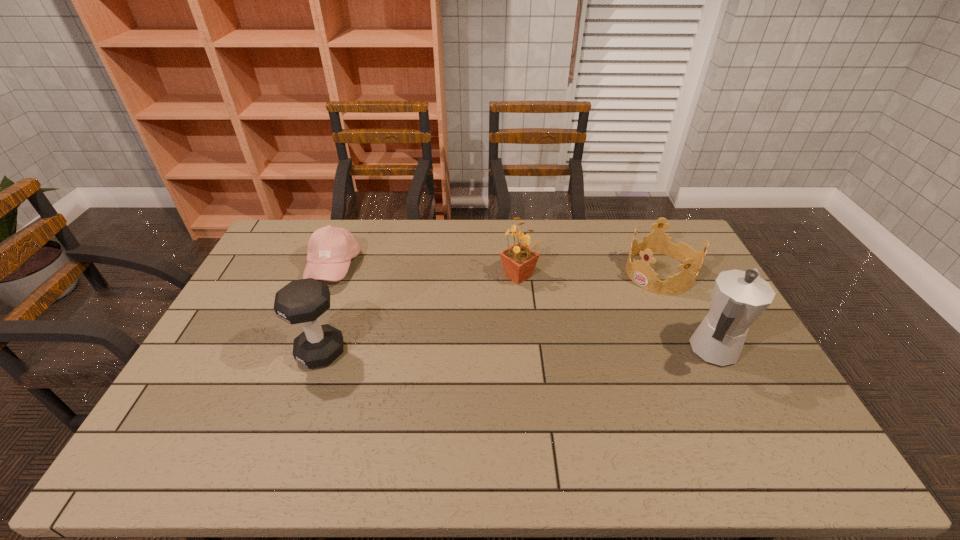
Where is `dumbbell`? The height and width of the screenshot is (540, 960). dumbbell is located at coordinates [x=302, y=301].

Find the location of a particular element. This screenshot has width=960, height=540. the tallest object is located at coordinates (739, 297).

Locate an element on the screen. This screenshot has height=540, width=960. baseball cap is located at coordinates (330, 249).

Locate an element on the screen. tiara is located at coordinates (640, 272).

The height and width of the screenshot is (540, 960). What are the coordinates of `sunflower` in the screenshot? It's located at (518, 261).

Locate an element on the screen. The image size is (960, 540). free region located on the back of the dumbbell is located at coordinates (351, 265).

Find the location of a particular element. free region located on the left of the coffeepot is located at coordinates (618, 352).

Image resolution: width=960 pixels, height=540 pixels. What are the coordinates of `vacant region located on the front-facing side of the baseball cap` in the screenshot? It's located at (431, 329).

Locate an element on the screen. This screenshot has height=540, width=960. vacant space located on the front-facing side of the baseball cap is located at coordinates (399, 312).

I want to click on free spot located on the front-facing side of the baseball cap, so click(x=363, y=290).